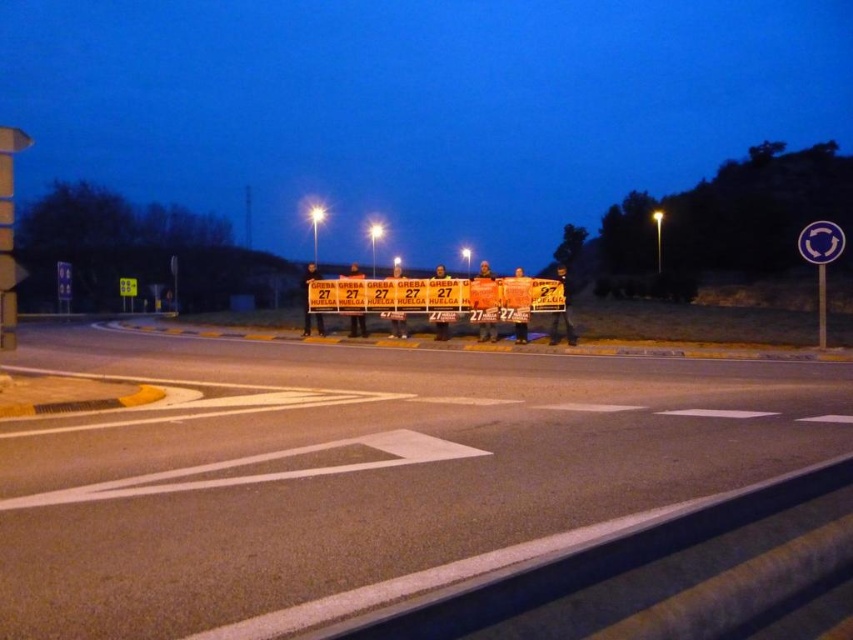
Which is below, metallic reflective circle at upper right or yellow reflective square at upper left?

metallic reflective circle at upper right is lower down.

Between point (831, 250) and point (129, 282), which one is positioned in front?

Point (831, 250) is in front.

Identify the location of metallic reflective circle at upper right. (820, 243).